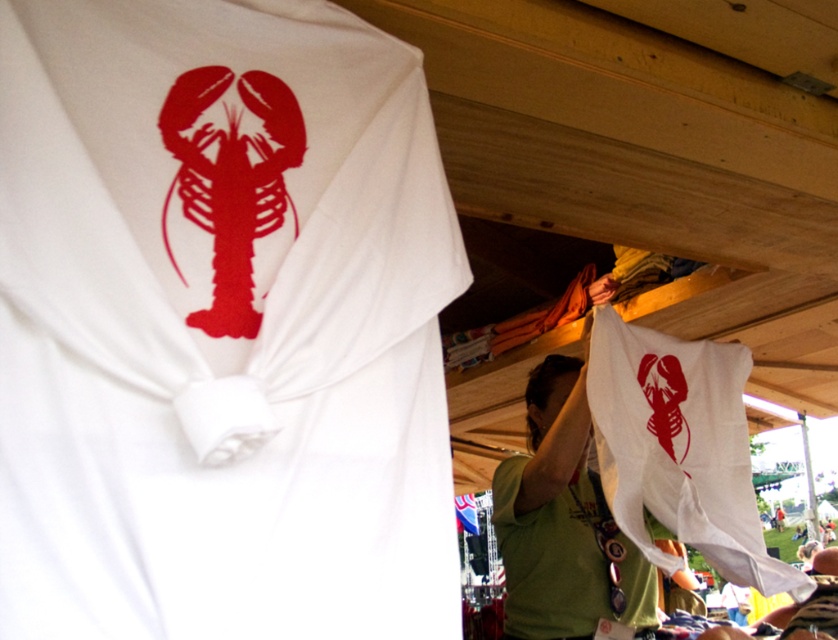
Between point (128, 484) and point (676, 422), which one is positioned behind?

The point (676, 422) is more distant.

Who is shorter, white matte lobster at center or white fabric bag at lower right?

With less height is white fabric bag at lower right.

Who is more forward, (x=128, y=388) or (x=735, y=460)?

Point (x=128, y=388) is more forward.

At what (x,y) coordinates should I click in order to perform the action: click on white matte lobster at center. Please return your answer as a coordinate pair (x, y). This screenshot has height=640, width=838. Looking at the image, I should click on (221, 324).

The width and height of the screenshot is (838, 640). Describe the element at coordinates (679, 448) in the screenshot. I see `white fabric bag at lower right` at that location.

Looking at this image, measure the distance from white fabric bag at lower right to white matte cloth at center.

The distance of white fabric bag at lower right from white matte cloth at center is 10.14 inches.

Image resolution: width=838 pixels, height=640 pixels. Describe the element at coordinates (679, 448) in the screenshot. I see `white fabric bag at lower right` at that location.

At what (x,y) coordinates should I click in order to perform the action: click on white fabric bag at lower right. Please return your answer as a coordinate pair (x, y). Looking at the image, I should click on (679, 448).

Does white matte lobster at center have a smaller size compared to white matte cloth at center?

Incorrect, white matte lobster at center is not smaller in size than white matte cloth at center.

Is white matte lobster at center bigger than white matte cloth at center?

Indeed, white matte lobster at center has a larger size compared to white matte cloth at center.

You are a GUI agent. You are given a task and a screenshot of the screen. Output one action in this format:
    pyautogui.click(x=<x>, y=<y>)
    Task: Click on the white matte lobster at center
    
    Given the screenshot: What is the action you would take?
    tap(221, 324)

The image size is (838, 640). Find the location of `white matte lobster at center`. white matte lobster at center is located at coordinates (221, 324).